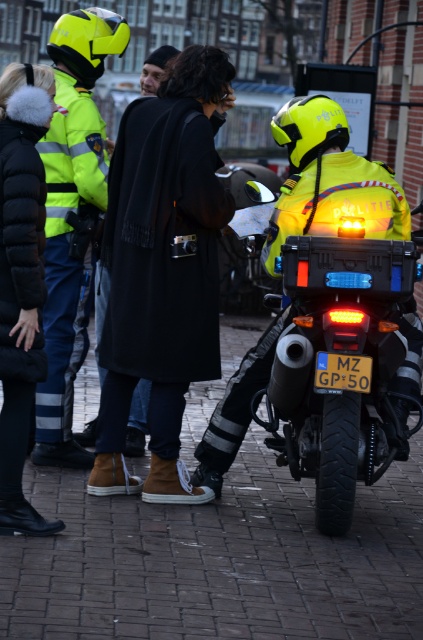
Question: Which of the following is the closest to the observer?

Choices:
 (A) neon yellow helmet at upper left
 (B) black wool coat at center

Answer: (A)

Question: Does neon yellow helmet at upper left have a greater width compared to black wool coat at center?

Choices:
 (A) no
 (B) yes

Answer: (B)

Question: Estimate the real-world distances between objects in this image. Which object is closer to the black wool coat at center?

Choices:
 (A) neon yellow helmet at upper left
 (B) high-visibility yellow jacket at center

Answer: (A)

Question: In this image, where is neon yellow helmet at upper left located relative to high-visibility yellow jacket at center?

Choices:
 (A) above
 (B) below

Answer: (B)

Question: Estimate the real-world distances between objects in this image. Which object is closer to the high-visibility yellow jacket at center?

Choices:
 (A) neon yellow helmet at upper left
 (B) black wool coat at center

Answer: (A)

Question: Is high-visibility yellow jacket at center smaller than black wool coat at center?

Choices:
 (A) no
 (B) yes

Answer: (A)